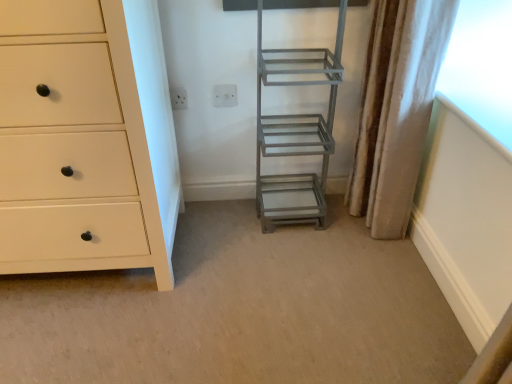
Question: Visually, is silky beige curtain at right positioned to the left or to the right of metallic gray ladder at center?

Choices:
 (A) left
 (B) right

Answer: (B)

Question: Looking at their shapes, would you say silky beige curtain at right is wider or thinner than metallic gray ladder at center?

Choices:
 (A) thin
 (B) wide

Answer: (A)

Question: Which object is the farthest from the silky beige curtain at right?

Choices:
 (A) white plastic electric outlet at upper center, the 1th electric outlet positioned from the right
 (B) metallic gray ladder at center
 (C) white plastic electric outlet at upper center, the 1th electric outlet positioned from the left
 (D) white matte chest of drawers at left

Answer: (D)

Question: Which object is positioned farthest from the white plastic electric outlet at upper center, the 1th electric outlet positioned from the left?

Choices:
 (A) metallic gray ladder at center
 (B) white matte chest of drawers at left
 (C) white plastic electric outlet at upper center, the 2th electric outlet when ordered from left to right
 (D) silky beige curtain at right

Answer: (D)